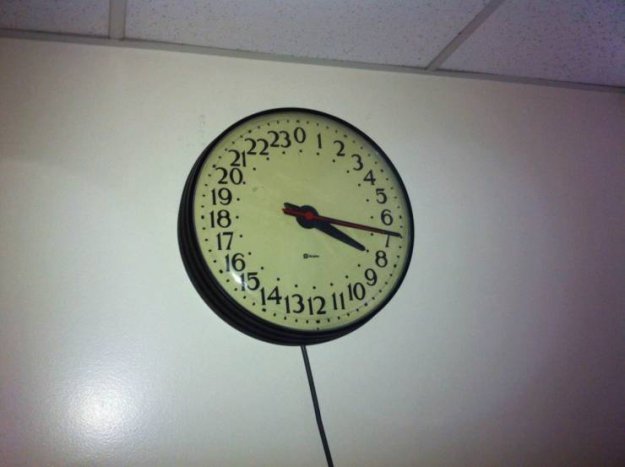
Where is `cord`? This screenshot has height=467, width=625. cord is located at coordinates (326, 445).